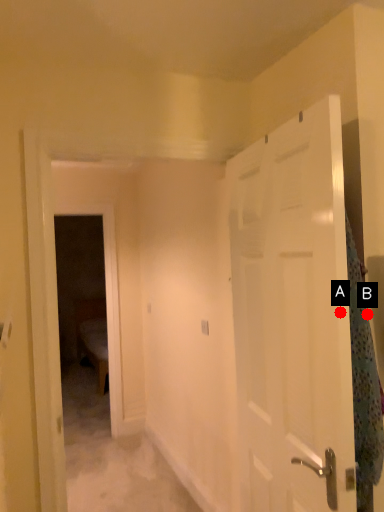
Question: Two points are circled on the image, labeled by A and B beside each circle. Among these points, which one is farthest from the camera?

Choices:
 (A) A is further
 (B) B is further

Answer: (B)